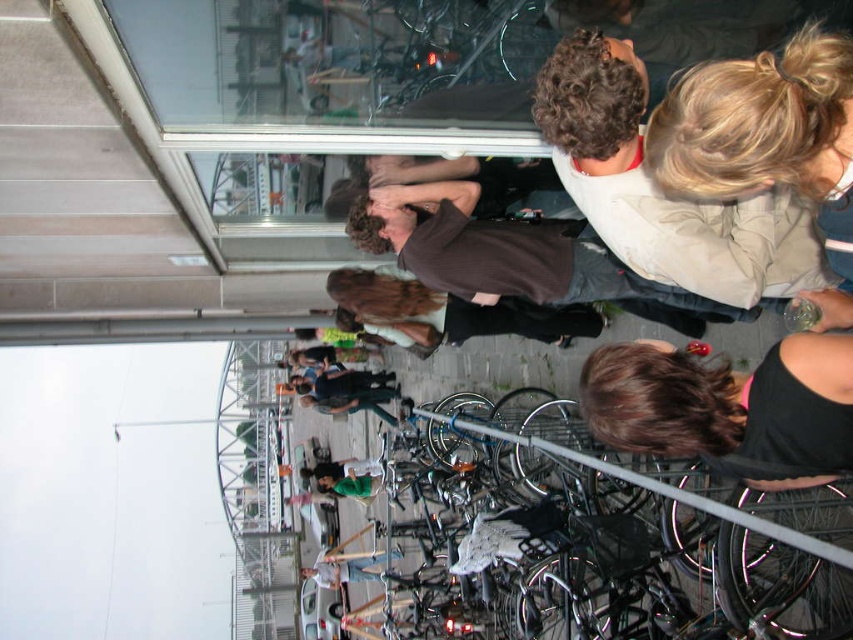
In the scene shown: Measure the distance between point (x=709, y=227) and camera.

Point (x=709, y=227) and camera are 26.64 feet apart.

Can you confirm if light beige jacket at upper right is wider than black fabric at lower right?

Yes.

Is point (657, 237) less distant than point (821, 369)?

No, it is not.

Locate an element on the screen. light beige jacket at upper right is located at coordinates (659, 188).

Is black fabric at lower right wider than brown sweater at center?

No, black fabric at lower right is not wider than brown sweater at center.

Can you confirm if black fabric at lower right is bigger than brown sweater at center?

No, black fabric at lower right is not bigger than brown sweater at center.

The height and width of the screenshot is (640, 853). Describe the element at coordinates (727, 404) in the screenshot. I see `black fabric at lower right` at that location.

Where is `black fabric at lower right`? Image resolution: width=853 pixels, height=640 pixels. black fabric at lower right is located at coordinates (727, 404).

Is brown matte shirt at upper center to the right of light blue jeans at center from the viewer's perspective?

Yes, brown matte shirt at upper center is to the right of light blue jeans at center.

Between brown matte shirt at upper center and light blue jeans at center, which one is positioned higher?

brown matte shirt at upper center is higher up.

Identify the location of brown matte shirt at upper center. This screenshot has height=640, width=853. (503, 252).